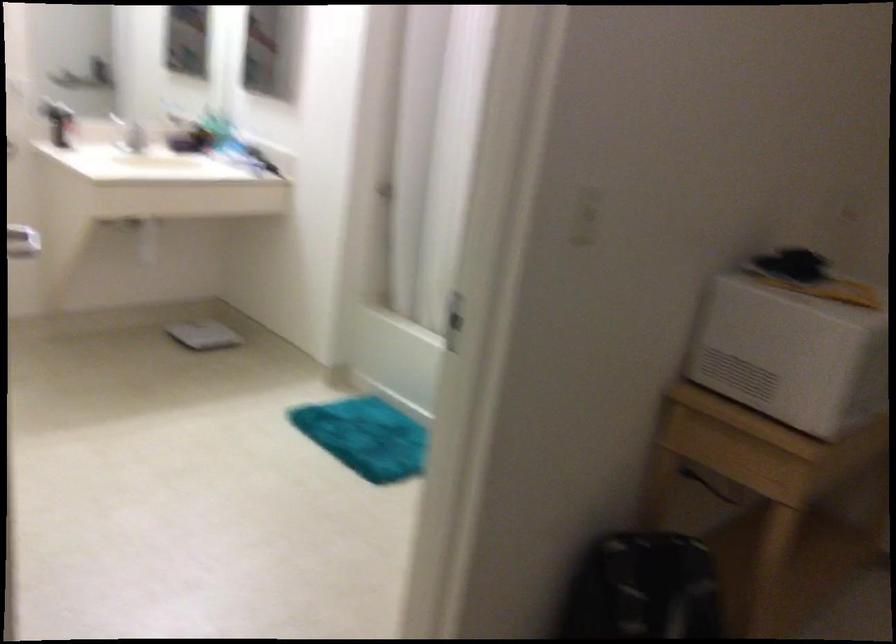
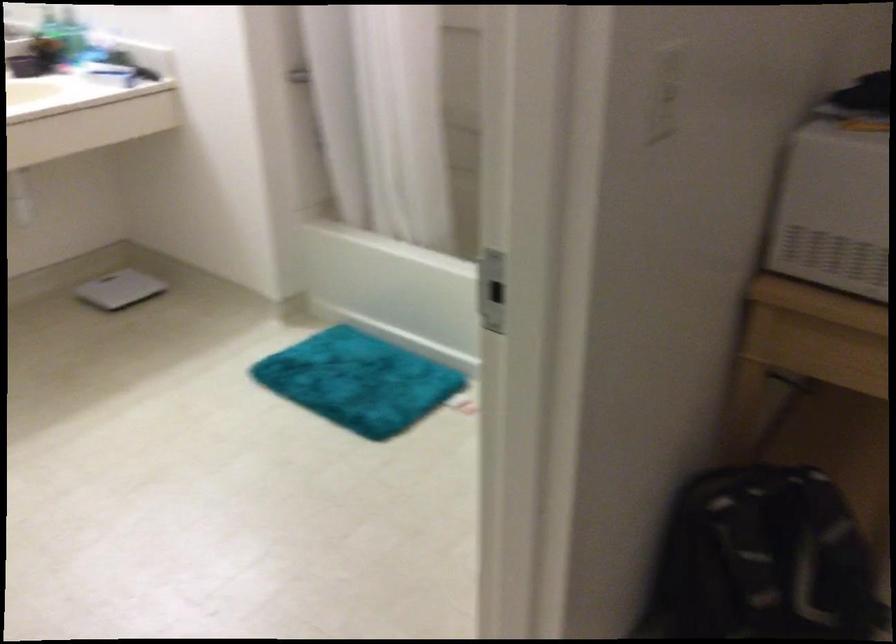
In the second image, find the point that corresponds to pixel 590 211 in the first image.

(666, 93)